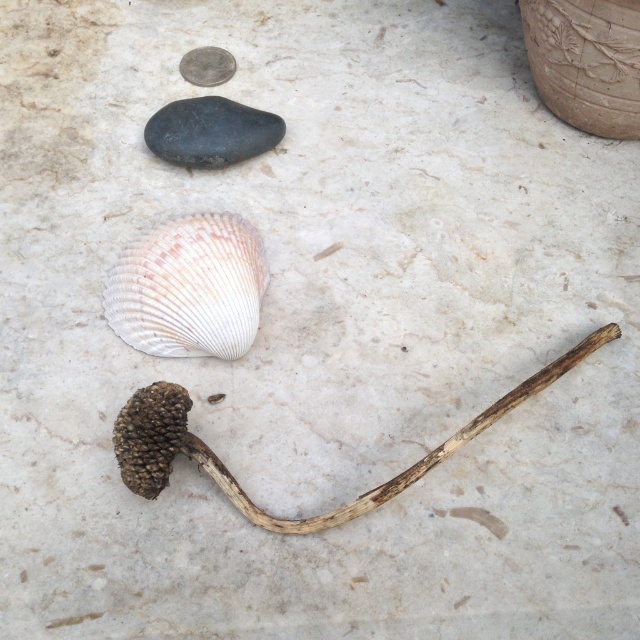
You are an archaeologist examining the image. You need to determine the spatial relationship between the pearly white shell at center and the black smooth rock at upper left. Which object is closer to the viewer?

The pearly white shell at center is closer to the viewer than the black smooth rock at upper left because it is positioned in front of it.

You are examining the arrangement of objects on the surface. The pearly white shell at center is placed where? Please provide its coordinates as per the image grid system.

The pearly white shell at center is located at point (189, 288) according to the image grid system.